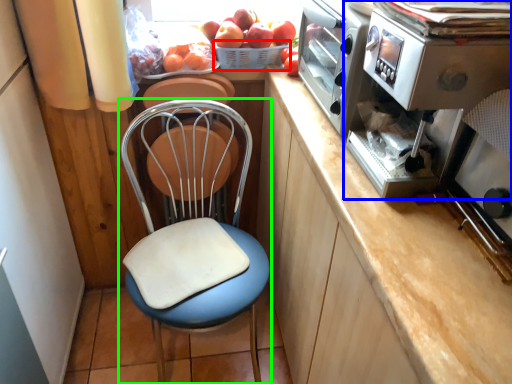
Question: Which is farther away from basket (highlighted by a red box)? kitchen appliance (highlighted by a blue box) or chair (highlighted by a green box)?

Choices:
 (A) kitchen appliance
 (B) chair

Answer: (A)